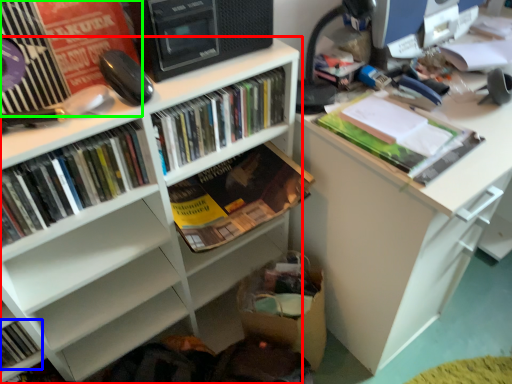
Question: Which object is positioned closest to bookcase (highlighted by a red box)? Select from book (highlighted by a blue box) and shelf (highlighted by a green box).

Choices:
 (A) book
 (B) shelf

Answer: (A)